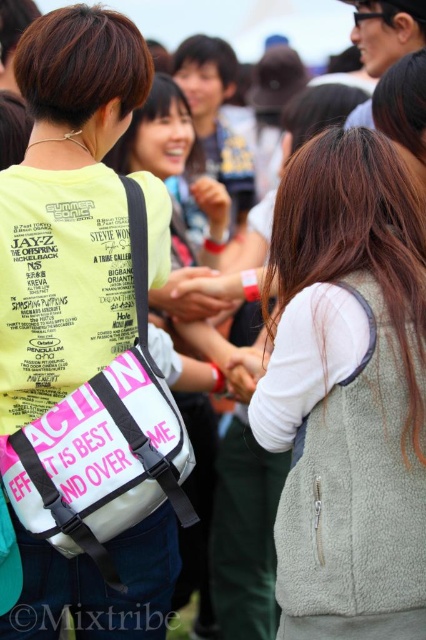
Question: Can you confirm if smooth skin hand at center is smaller than matte skin hand at center?

Choices:
 (A) no
 (B) yes

Answer: (A)

Question: Among these objects, which one is nearest to the camera?

Choices:
 (A) matte skin hand at center
 (B) white matte hand at center

Answer: (B)

Question: Does fuzzy gray vest at center come behind matte skin hand at center?

Choices:
 (A) no
 (B) yes

Answer: (A)

Question: Considering the real-world distances, which object is closest to the white matte backpack at center?

Choices:
 (A) fuzzy gray vest at center
 (B) white matte hand at center

Answer: (B)

Question: Is white matte backpack at center positioned at the back of white matte hand at center?

Choices:
 (A) yes
 (B) no

Answer: (A)

Question: Which point is farther to the camera?

Choices:
 (A) (189, 166)
 (B) (201, 204)
 (C) (183, 316)

Answer: (A)